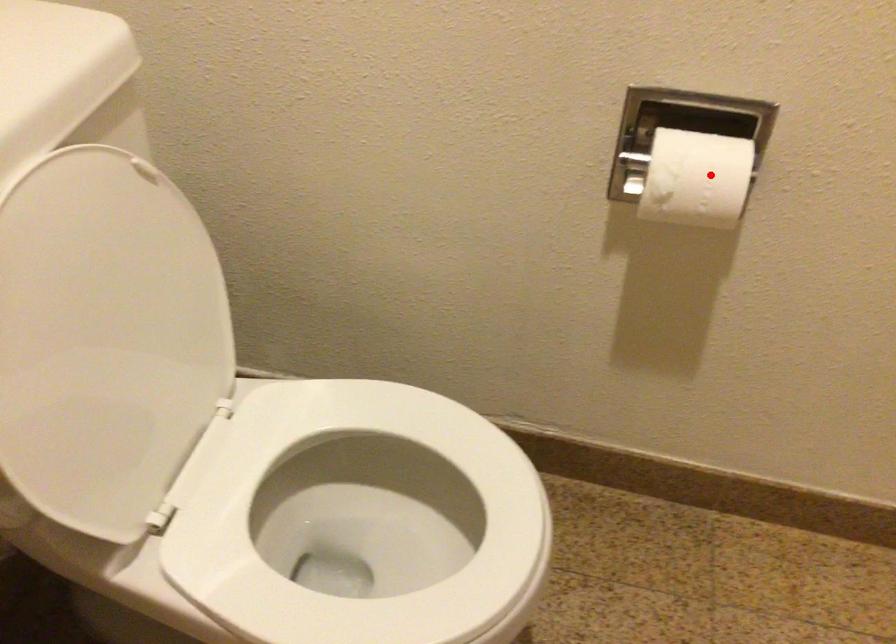
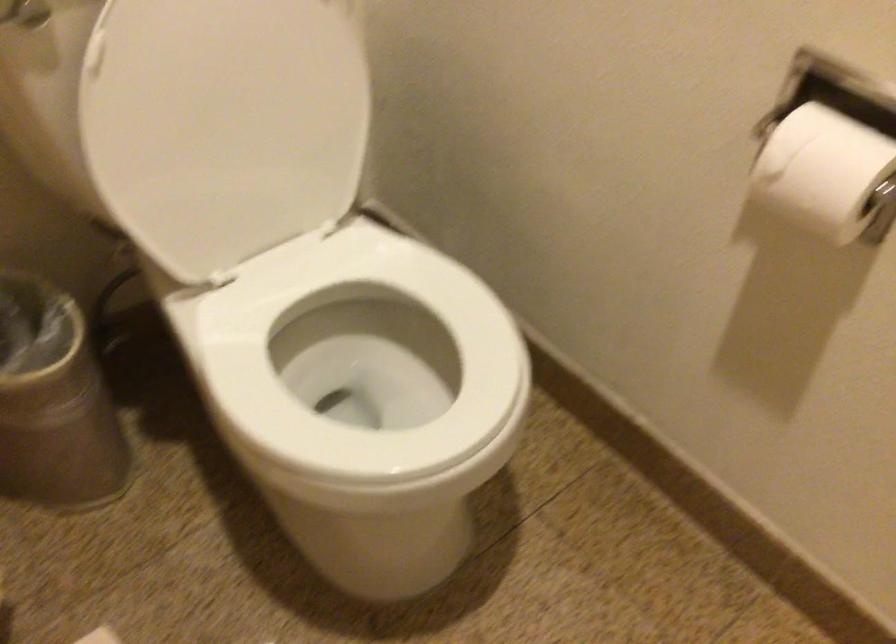
Question: I am providing you with two images of the same scene from different viewpoints. In image1, a red point is highlighted. Considering the same 3D point in image2, which of the following is correct?

Choices:
 (A) It is closer
 (B) It is farther

Answer: (A)